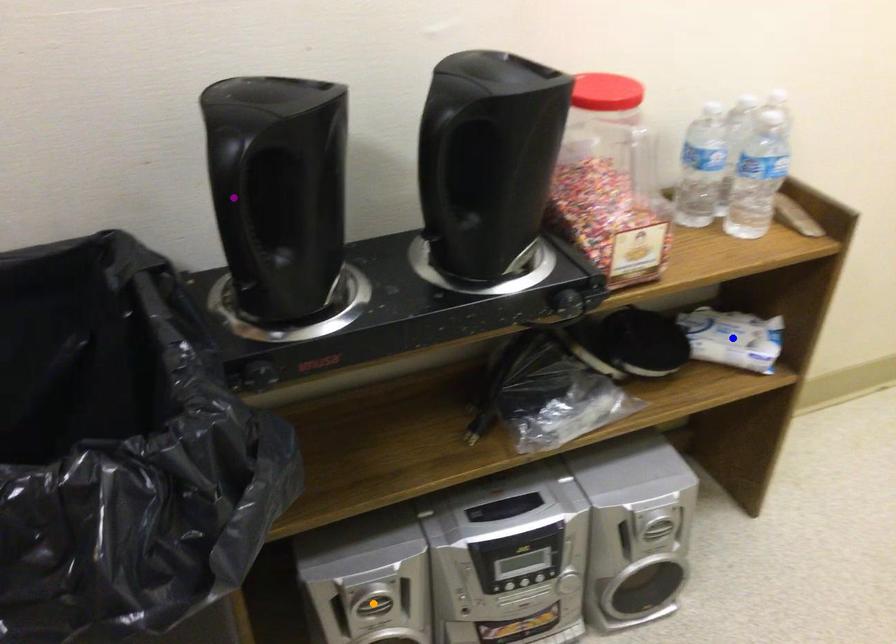
Order these from nearest to farthest:
1. blue point
2. orange point
3. purple point

purple point, orange point, blue point